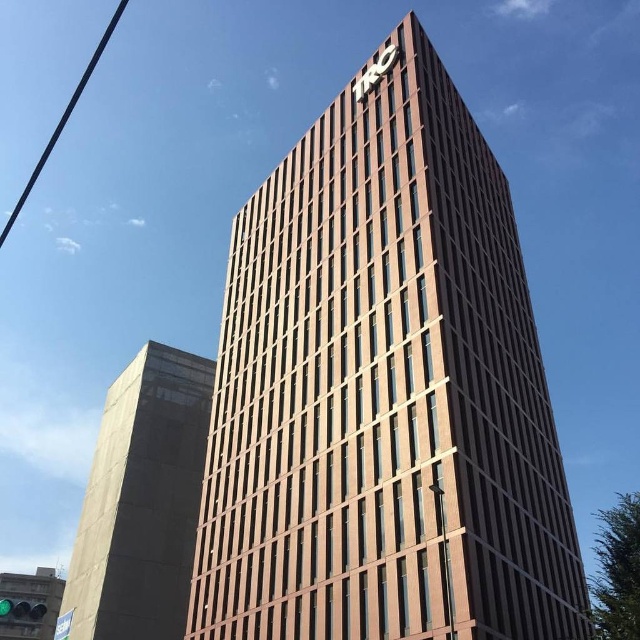
Does concrete tower at left have a lesser width compared to black wire at upper left?

Yes, concrete tower at left is thinner than black wire at upper left.

Is concrete tower at left closer to the viewer compared to black wire at upper left?

Yes, concrete tower at left is closer to the viewer.

Is point (164, 636) behind point (33, 180)?

That is False.

Identify the location of concrete tower at left. This screenshot has width=640, height=640. (141, 500).

Looking at this image, who is positioned more to the left, brown brick building at center or concrete tower at left?

Result: Positioned to the left is concrete tower at left.

Is brown brick building at center shorter than concrete tower at left?

Incorrect, brown brick building at center's height does not fall short of concrete tower at left's.

Does point (204, 625) lie in front of point (136, 378)?

That is True.

The height and width of the screenshot is (640, 640). Find the location of `brown brick building at center`. brown brick building at center is located at coordinates (384, 390).

Does brown brick building at center have a greater height compared to black wire at upper left?

In fact, brown brick building at center may be shorter than black wire at upper left.

At what (x,y) coordinates should I click in order to perform the action: click on brown brick building at center. Please return your answer as a coordinate pair (x, y). The image size is (640, 640). Looking at the image, I should click on (384, 390).

Identify the location of brown brick building at center. The height and width of the screenshot is (640, 640). (384, 390).